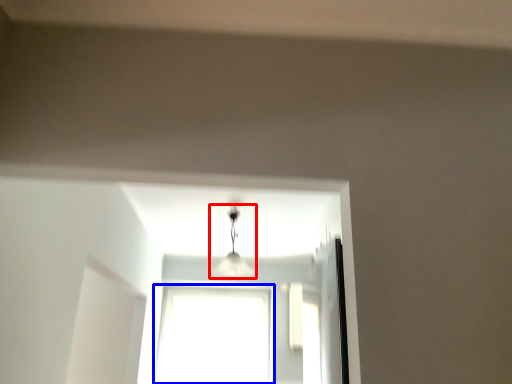
Question: Which point is further to the camera, lamp (highlighted by a red box) or window (highlighted by a blue box)?

Choices:
 (A) lamp
 (B) window

Answer: (B)